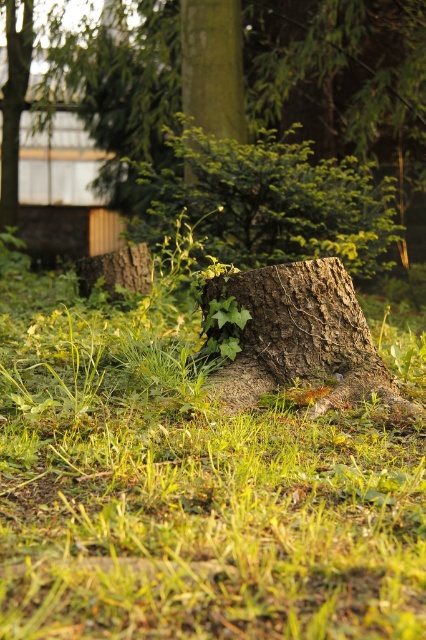
You are standing at the origin point of the image coordinate system. You want to walk to the green grass at center. What are the coordinates you need to move to?

The coordinates you need to move to are point (189,486).

You are a landscape architect designing a garden path that needs to be 10 meters wide. You notice the smooth brown stump at center and the green mossy bark at center in the scene. Can the space between them accommodate the path?

The smooth brown stump at center is 9.68 meters from the green mossy bark at center. Since the path requires 10 meters, the distance is insufficient by 0.32 meters, so the path cannot fit between them.